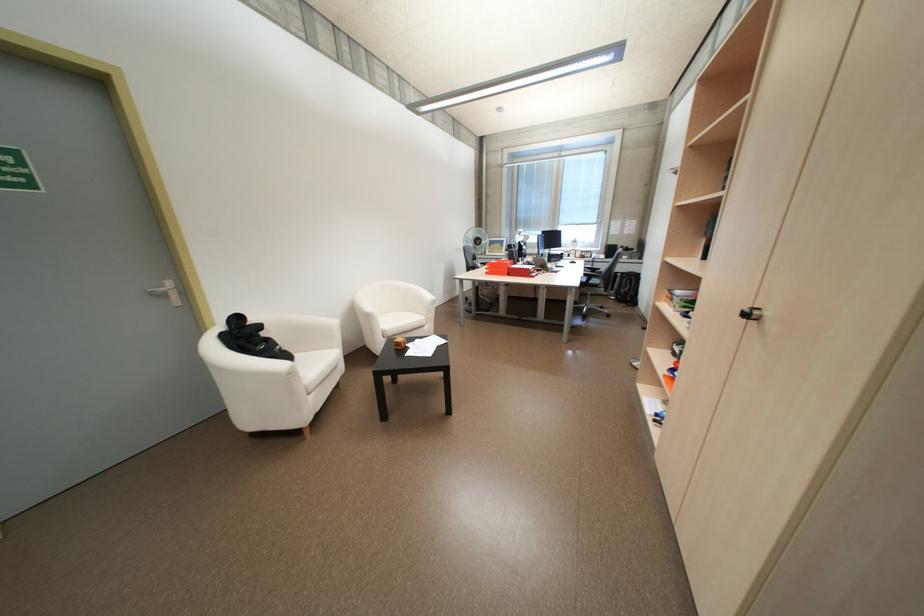
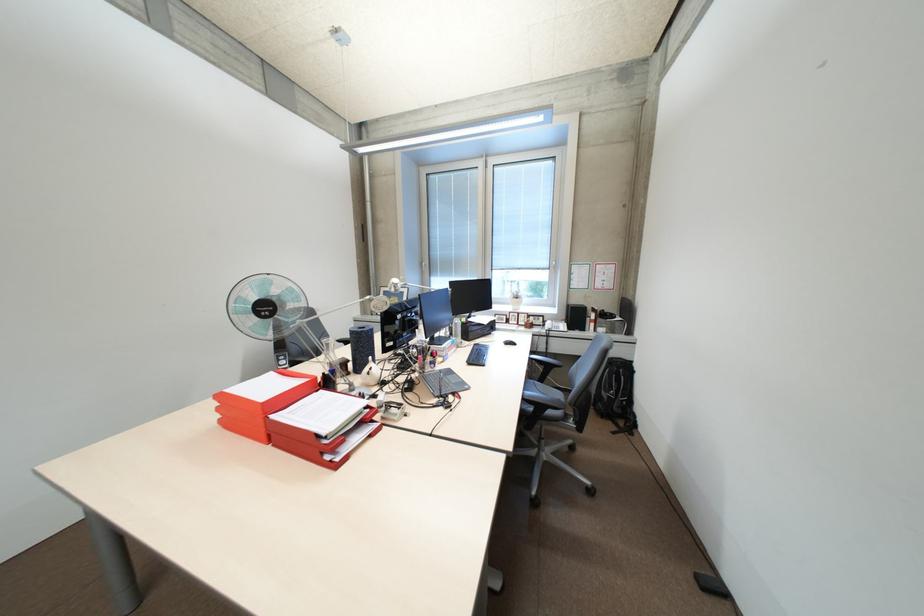
The point at (496,272) is marked in the first image. Where is the corresponding point in the second image?

(231, 421)